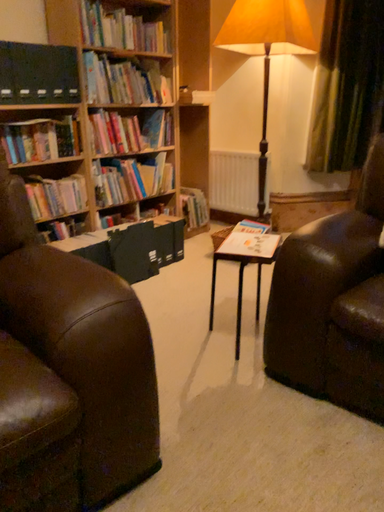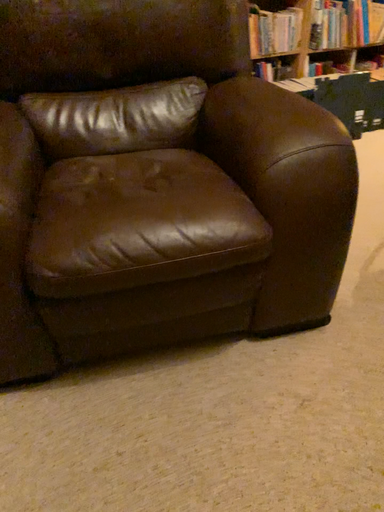
Question: Which way did the camera rotate in the video?

Choices:
 (A) rotated left
 (B) rotated right

Answer: (A)